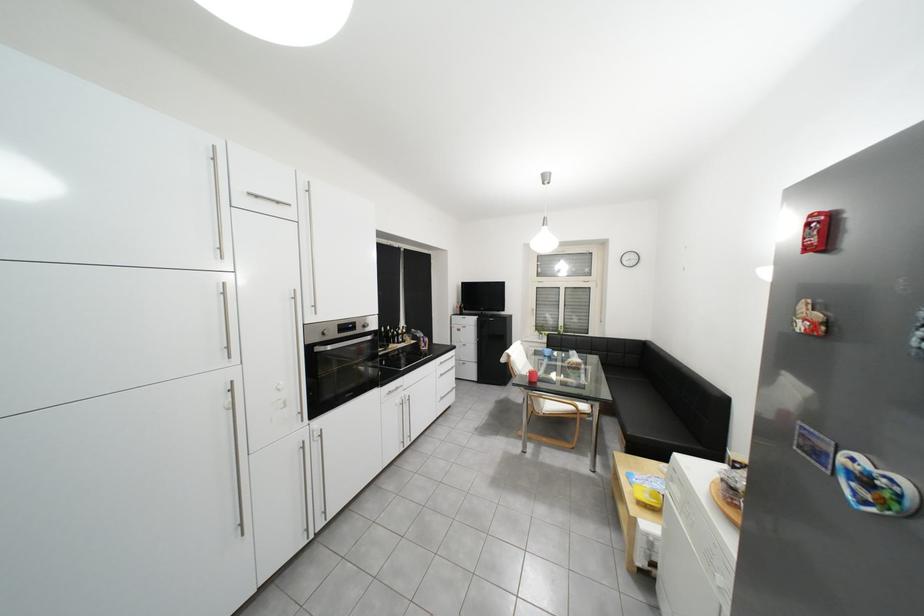
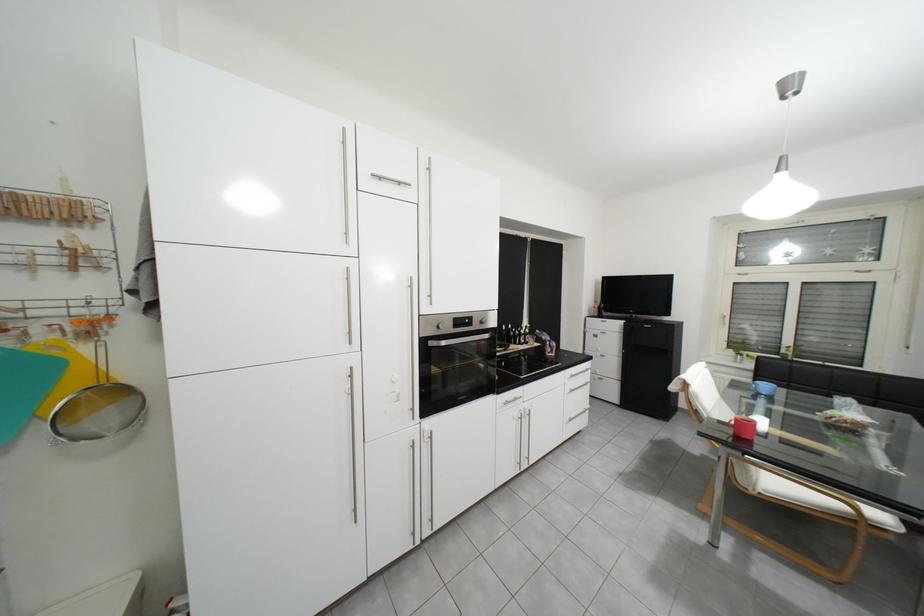
Question: How did the camera likely rotate?

Choices:
 (A) Left
 (B) Right
 (C) Up
 (D) Down

Answer: (A)